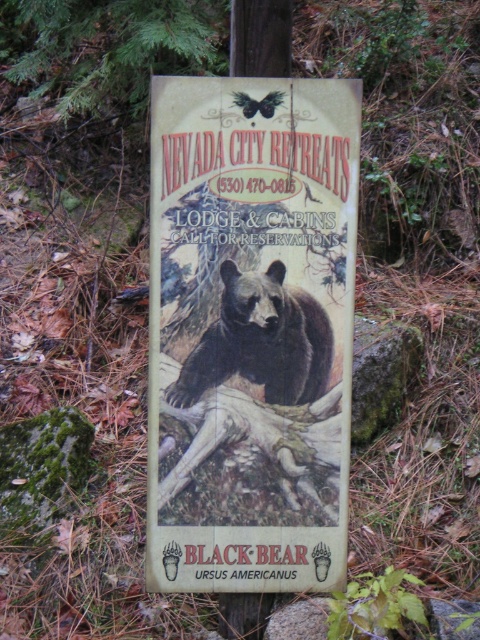
Question: Which object is closer to the camera taking this photo?

Choices:
 (A) wooden sign at center
 (B) wooden signboard at center

Answer: (B)

Question: In this image, where is wooden signboard at center located relative to brown fur bear at center?

Choices:
 (A) below
 (B) above

Answer: (B)

Question: Which of the following is the farthest from the observer?

Choices:
 (A) (279, 141)
 (B) (249, 280)

Answer: (B)

Question: Is wooden signboard at center positioned in front of brown fur bear at center?

Choices:
 (A) yes
 (B) no

Answer: (A)

Question: Among these objects, which one is nearest to the camera?

Choices:
 (A) wooden signboard at center
 (B) brown fur bear at center

Answer: (A)

Question: Is wooden signboard at center smaller than brown fur bear at center?

Choices:
 (A) no
 (B) yes

Answer: (A)